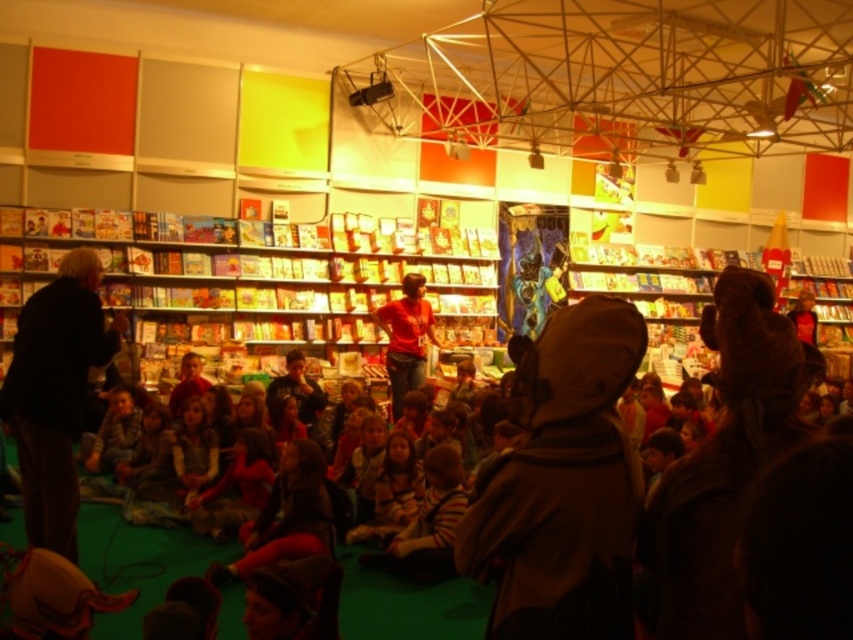
Question: Among these points, which one is nearest to the camera?

Choices:
 (A) tap(22, 294)
 (B) tap(126, 440)

Answer: (B)

Question: Which object is the closest to the matte red shirt at center?

Choices:
 (A) striped sweater at lower left
 (B) dark brown jacket at left

Answer: (A)

Question: Can you confirm if dark brown jacket at left is positioned below matte red shirt at center?

Choices:
 (A) yes
 (B) no

Answer: (A)

Question: Is dark brown jacket at left below striped sweater at lower left?

Choices:
 (A) no
 (B) yes

Answer: (A)

Question: Among these points, which one is farthest from the camera?

Choices:
 (A) (115, 436)
 (B) (112, 337)
 (C) (33, 275)

Answer: (C)

Question: Is matte red shirt at center positioned in front of striped sweater at lower left?

Choices:
 (A) yes
 (B) no

Answer: (B)